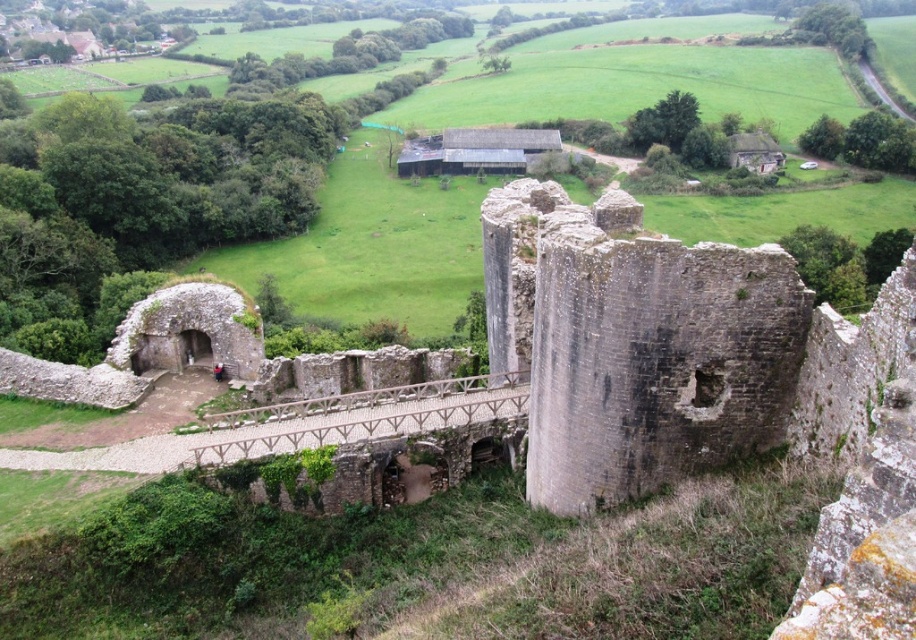
Question: Is gray stone ruins at center smaller than wooden bridge at center?

Choices:
 (A) no
 (B) yes

Answer: (A)

Question: Is gray stone ruins at center bigger than wooden bridge at center?

Choices:
 (A) no
 (B) yes

Answer: (B)

Question: Which point appears farthest from the camera in this image?

Choices:
 (A) (685, 424)
 (B) (205, 452)

Answer: (B)

Question: Does gray stone ruins at center have a lesser width compared to wooden bridge at center?

Choices:
 (A) yes
 (B) no

Answer: (A)

Question: Which point appears farthest from the camera in this image?

Choices:
 (A) (363, 410)
 (B) (644, 308)

Answer: (A)